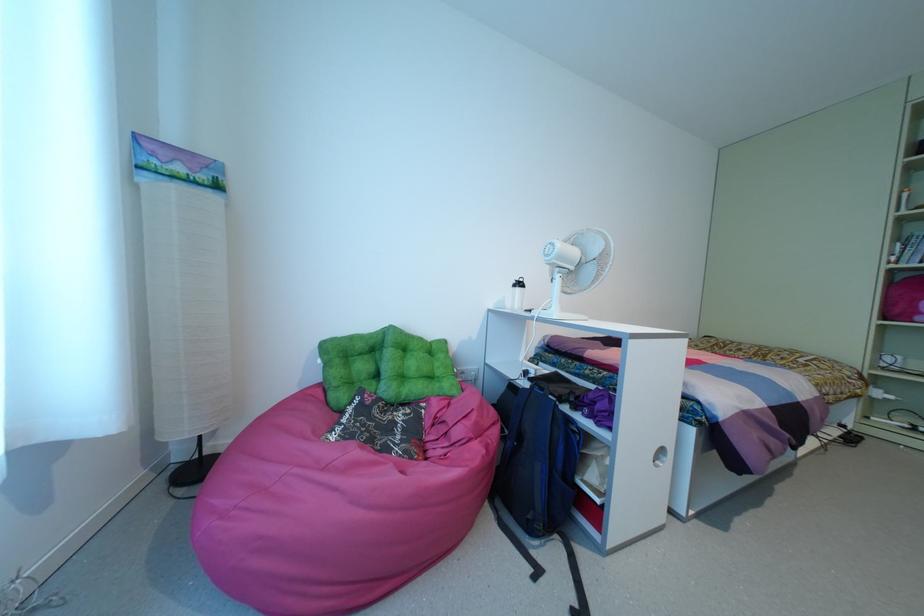
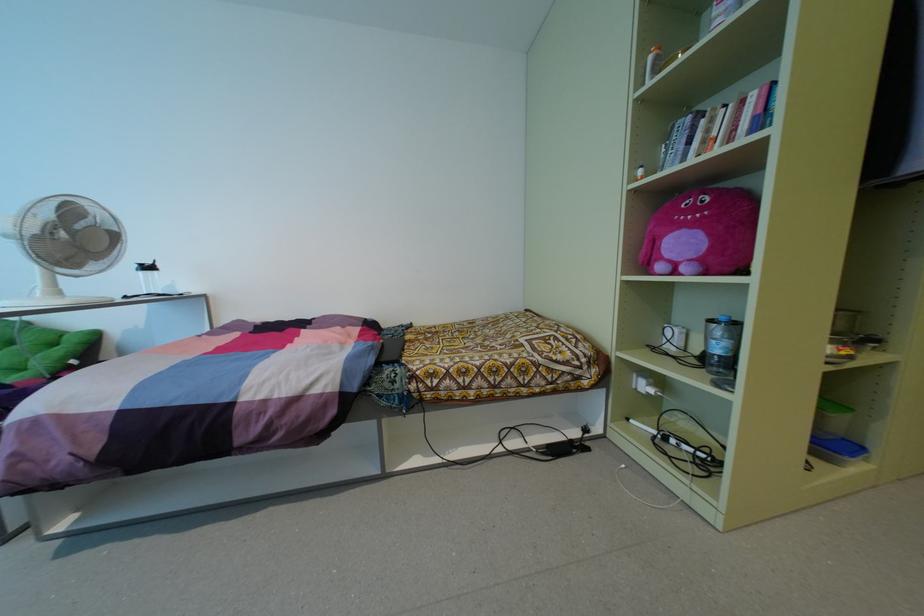
Where in the second image is the point corresponding to the point at 891,397 from the first image?

(650, 390)